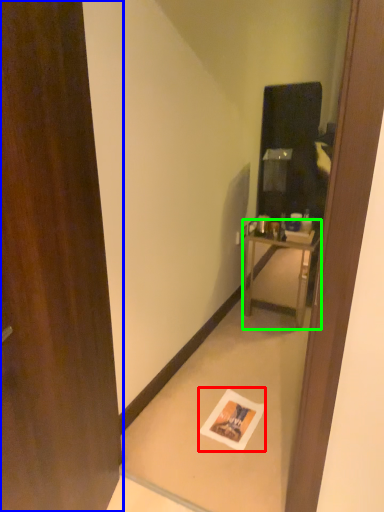
Question: Which object is the closest to the postcard (highlighted by a red box)? Choose among these: door (highlighted by a blue box) or nightstand (highlighted by a green box).

Choices:
 (A) door
 (B) nightstand

Answer: (A)